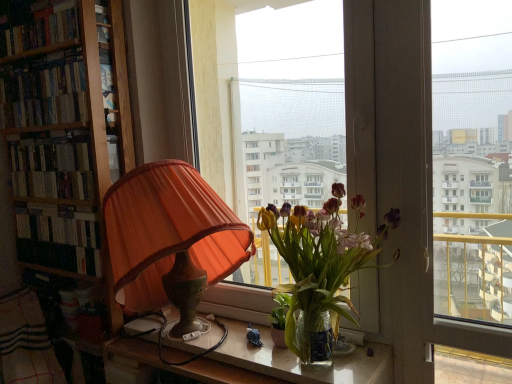
Question: From the image's perspective, relative to hardcover books at left, the 1th book when ordered from bottom to top, is hardcover books at upper left, which ranks as the 1th book in top-to-bottom order, above or below?

Choices:
 (A) below
 (B) above

Answer: (B)

Question: From a real-world perspective, is hardcover books at upper left, which ranks as the 1th book in top-to-bottom order, physically located above or below hardcover books at left, the 1th book when ordered from bottom to top?

Choices:
 (A) below
 (B) above

Answer: (B)

Question: Which of these objects is positioned farthest from the orange fabric lampshade at left?

Choices:
 (A) hardcover books at upper left, which ranks as the 3th book in bottom-to-top order
 (B) hardcover books at left, acting as the 3th book starting from the top
 (C) translucent glass vase at center
 (D) plaid fabric at lower left
 (E) translucent glass table at lower center

Answer: (A)

Question: Estimate the real-world distances between objects in this image. Which object is closer to the hardcover books at left, the second book in the bottom-to-top sequence?

Choices:
 (A) hardcover books at upper left, which ranks as the 1th book in top-to-bottom order
 (B) hardcover books at left, acting as the 3th book starting from the top
 (C) translucent glass table at lower center
 (D) transparent glass window at center
 (E) plaid fabric at lower left

Answer: (A)